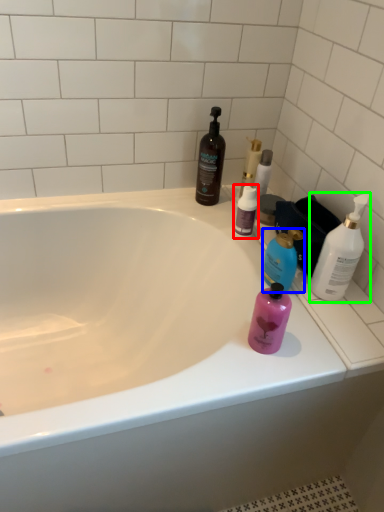
Question: Considering the real-world distances, which object is closest to bottle (highlighted by a red box)? bottle (highlighted by a blue box) or bottle (highlighted by a green box).

Choices:
 (A) bottle
 (B) bottle

Answer: (A)